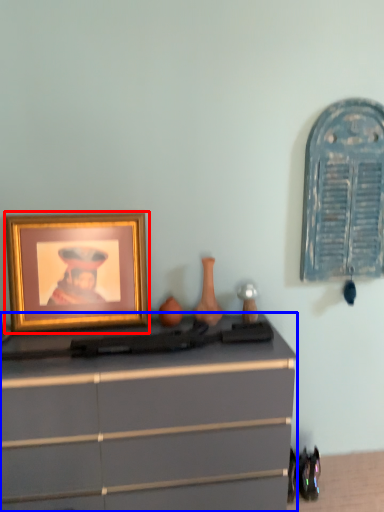
Question: Which object appears farthest to the camera in this image, picture frame (highlighted by a red box) or chest of drawers (highlighted by a blue box)?

Choices:
 (A) picture frame
 (B) chest of drawers

Answer: (A)